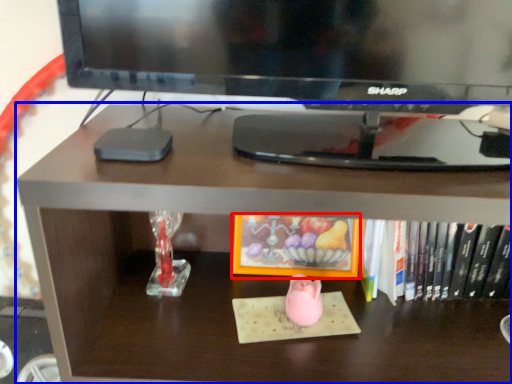
Question: Which object appears closest to the camera in this image, book (highlighted by a red box) or desk (highlighted by a blue box)?

Choices:
 (A) book
 (B) desk

Answer: (B)